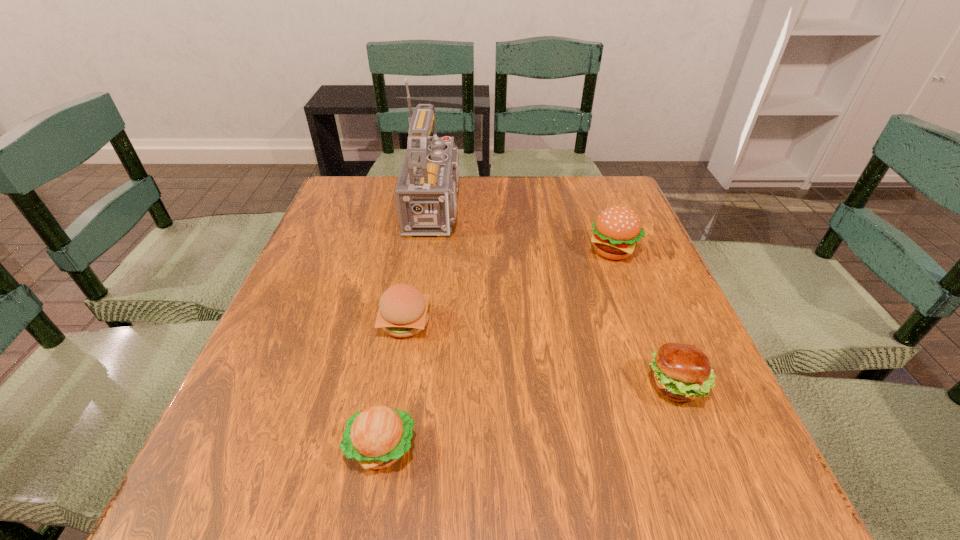
This screenshot has height=540, width=960. In order to click on the tallest object in this screenshot , I will do `click(426, 192)`.

You are a GUI agent. You are given a task and a screenshot of the screen. Output one action in this format:
    pyautogui.click(x=<x>, y=<y>)
    Task: Click on the farthest hamburger
    
    Given the screenshot: What is the action you would take?
    point(617,230)

The image size is (960, 540). In order to click on the second tallest object in this screenshot , I will do `click(617, 230)`.

This screenshot has width=960, height=540. I want to click on the third nearest hamburger, so click(x=403, y=310).

Where is `the second nearest object`? the second nearest object is located at coordinates (680, 372).

The height and width of the screenshot is (540, 960). Find the location of `the nearest object`. the nearest object is located at coordinates (376, 437).

Identify the location of vacant space located on the front-facing side of the tallest object. Image resolution: width=960 pixels, height=540 pixels. (544, 206).

Find the location of a particular element. Image resolution: width=960 pixels, height=540 pixels. free region located 0.150m on the left of the second tallest object is located at coordinates (525, 251).

At what (x,y) coordinates should I click in order to perform the action: click on free region located 0.310m on the front of the third nearest hamburger. Please return your answer as a coordinate pair (x, y). Looking at the image, I should click on (372, 508).

This screenshot has height=540, width=960. What are the coordinates of `vacant region located 0.390m on the left of the second nearest hamburger` in the screenshot? It's located at (425, 386).